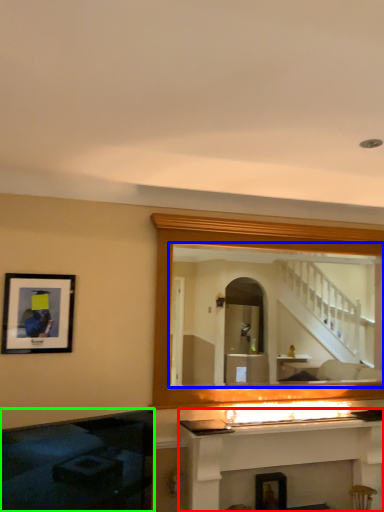
Question: Estimate the real-world distances between objects in this image. Which object is farther from fireplace (highlighted by a red box), mirror (highlighted by a blue box) or fireplace (highlighted by a green box)?

Choices:
 (A) mirror
 (B) fireplace

Answer: (A)